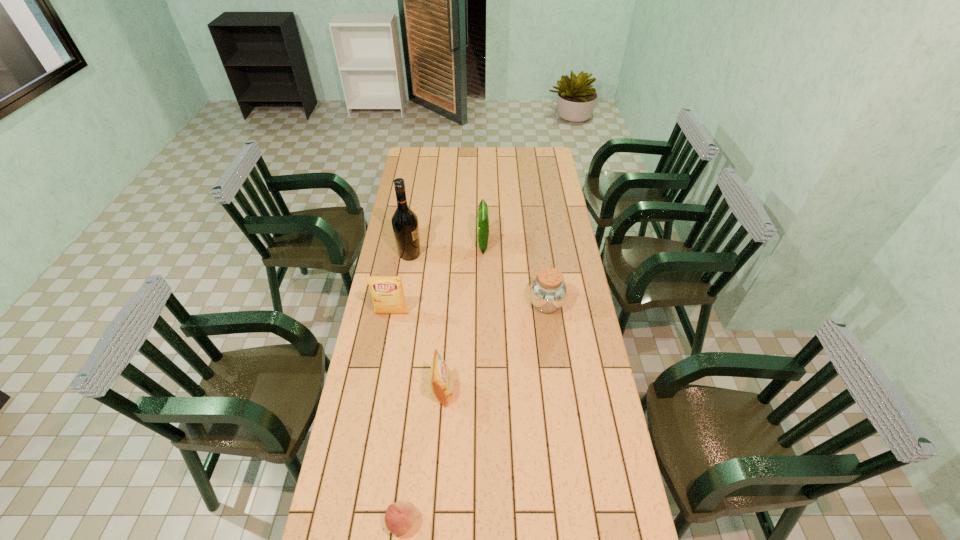
The height and width of the screenshot is (540, 960). In the image, there is a desktop. In order to click on vacant space at the far edge in this screenshot , I will do `click(485, 165)`.

Find the location of a particular element. This screenshot has height=540, width=960. vacant region at the left edge of the desktop is located at coordinates (382, 323).

What are the coordinates of `free space at the right edge` in the screenshot? It's located at (572, 428).

In the image, there is a desktop. Where is `vacant space at the far right corner`? vacant space at the far right corner is located at coordinates point(540,148).

Where is `free space between the jar and the fourth object from left to right`? The height and width of the screenshot is (540, 960). free space between the jar and the fourth object from left to right is located at coordinates (494, 348).

Locate an element on the screen. The height and width of the screenshot is (540, 960). free space between the shortest object and the second crisp (potato chip) from right to left is located at coordinates (422, 457).

Image resolution: width=960 pixels, height=540 pixels. Identify the location of free area in between the second crisp (potato chip) from left to right and the wine bottle. (426, 323).

This screenshot has height=540, width=960. What are the coordinates of `vacant region between the third object from right to left and the rightmost crisp (potato chip)` in the screenshot? It's located at (463, 318).

Find the location of a particular element. The width and height of the screenshot is (960, 540). free spot between the wine bottle and the shortest object is located at coordinates (406, 388).

Find the location of a particular element. This screenshot has height=540, width=960. blank region between the peach and the tallest object is located at coordinates (406, 388).